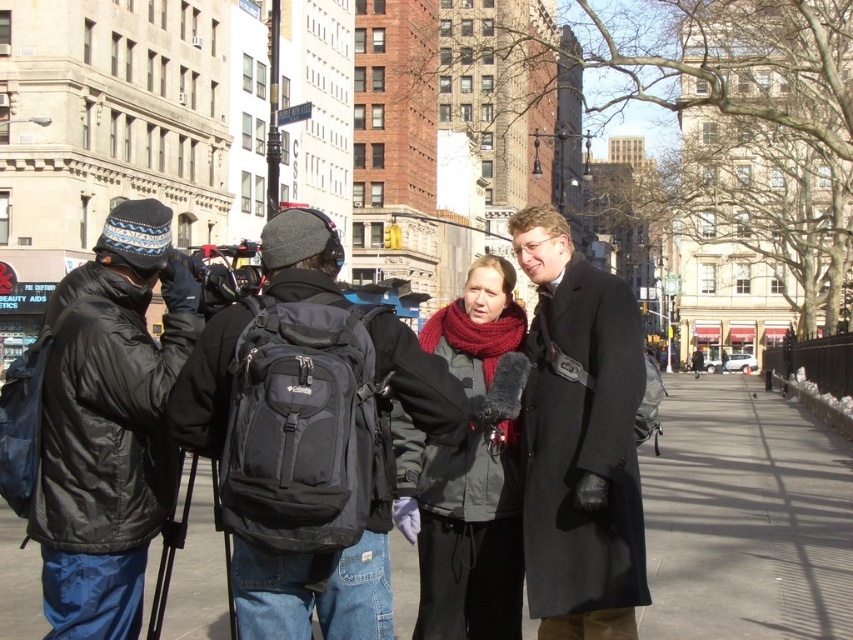
What is located at the coordinates point (746, 516) in the image?

The point (746, 516) marks the black fabric pavement at center.

You are a delivery person who needs to place a package on the black fabric pavement at center. You are currently holding the black nylon backpack at center. Can you reach the pavement without moving the backpack?

The black fabric pavement at center and black nylon backpack at center are 26.35 meters apart from each other. Since the distance is too large, you cannot reach the pavement without moving the backpack.